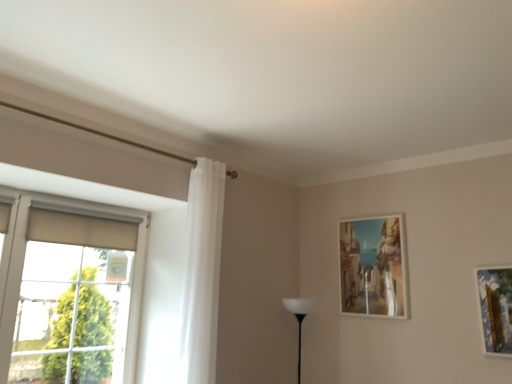
Question: Considering the positions of point (42, 352) and point (345, 281), is point (42, 352) closer or farther from the camera than point (345, 281)?

Choices:
 (A) farther
 (B) closer

Answer: (B)

Question: From the image's perspective, relative to matte wooden picture frame at upper right, is matte beige roller blind at left above or below?

Choices:
 (A) below
 (B) above

Answer: (A)

Question: Which object is the closest to the white sheer curtain at left?

Choices:
 (A) white matte table lamp at center
 (B) matte wooden picture frame at upper right
 (C) matte beige roller blind at left

Answer: (C)

Question: Which of these objects is positioned farthest from the matte wooden picture frame at upper right?

Choices:
 (A) white matte table lamp at center
 (B) matte beige roller blind at left
 (C) white sheer curtain at left

Answer: (B)